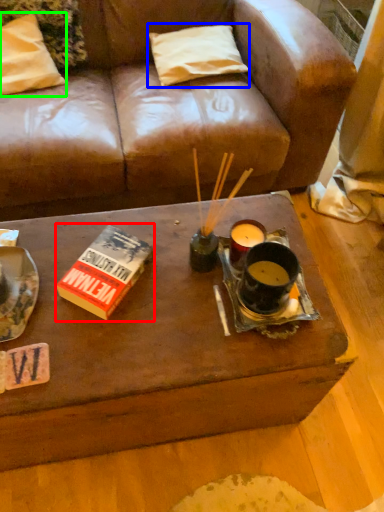
Question: Based on their relative distances, which object is farther from paperback book (highlighted by a red box)? Choose from pillow (highlighted by a blue box) and pillow (highlighted by a green box).

Choices:
 (A) pillow
 (B) pillow

Answer: (A)